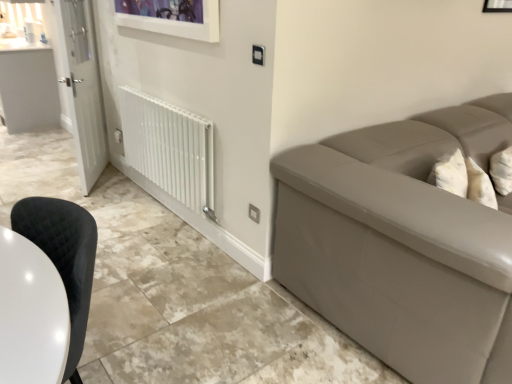
Where is `vacant space underneath white glossy door at left (from a real-world perspective)`? vacant space underneath white glossy door at left (from a real-world perspective) is located at coordinates (95, 181).